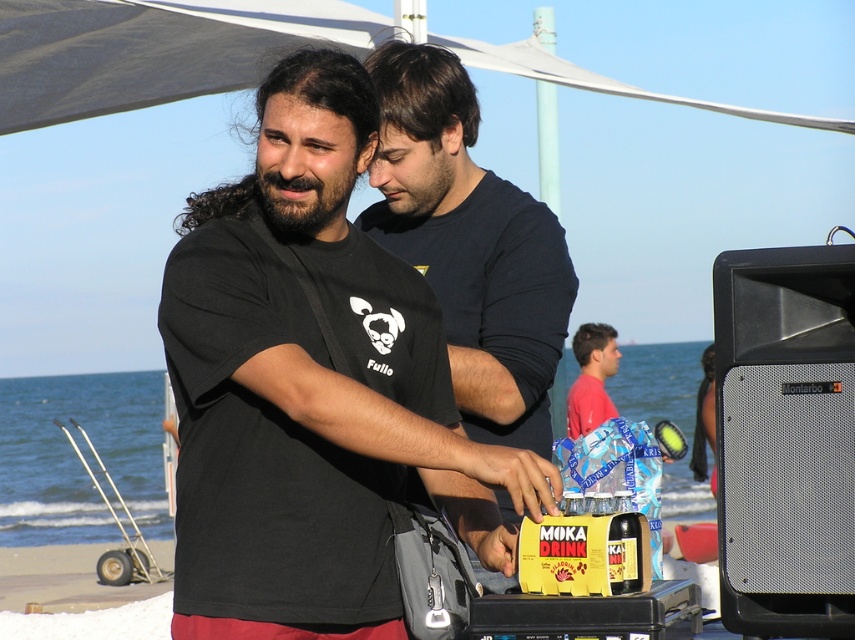
Which is below, red matte shirt at center or dark brown glass bottle at center?

Positioned lower is red matte shirt at center.

What do you see at coordinates (591, 378) in the screenshot?
I see `red matte shirt at center` at bounding box center [591, 378].

At what (x,y) coordinates should I click in order to perform the action: click on red matte shirt at center. Please return your answer as a coordinate pair (x, y). Looking at the image, I should click on (591, 378).

Does black matte t-shirt at center appear under dark brown glass bottle at center?

Actually, black matte t-shirt at center is above dark brown glass bottle at center.

Does point (246, 276) come in front of point (622, 588)?

No, it is behind (622, 588).

Locate an element on the screen. This screenshot has height=640, width=855. black matte t-shirt at center is located at coordinates (311, 388).

Between point (325, 285) and point (568, 419), which one is positioned in front?

Positioned in front is point (325, 285).

Is black matte t-shirt at center to the right of red matte shirt at center from the viewer's perspective?

No, black matte t-shirt at center is not to the right of red matte shirt at center.

Find the location of `black matte t-shirt at center`. black matte t-shirt at center is located at coordinates (311, 388).

Locate an element on the screen. This screenshot has height=640, width=855. black matte t-shirt at center is located at coordinates (311, 388).